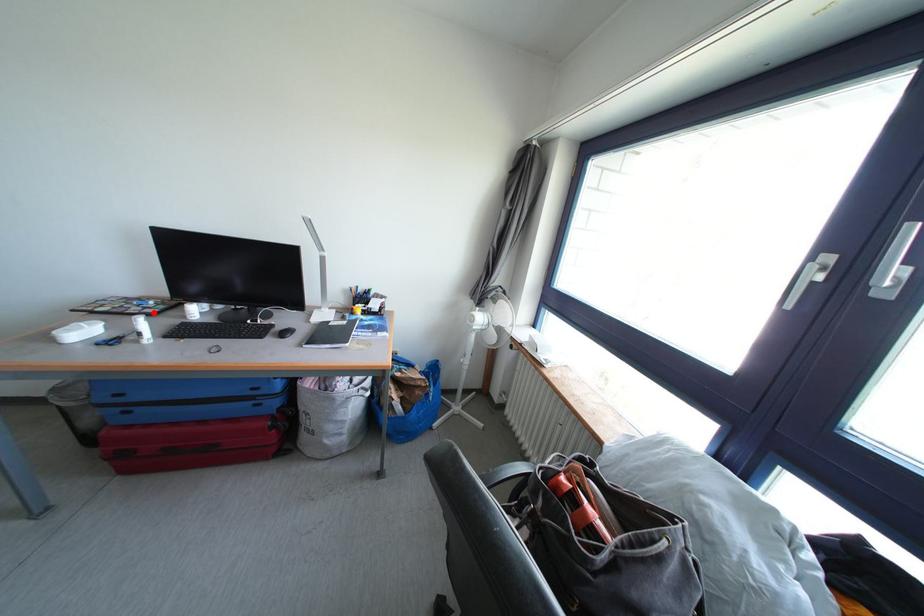
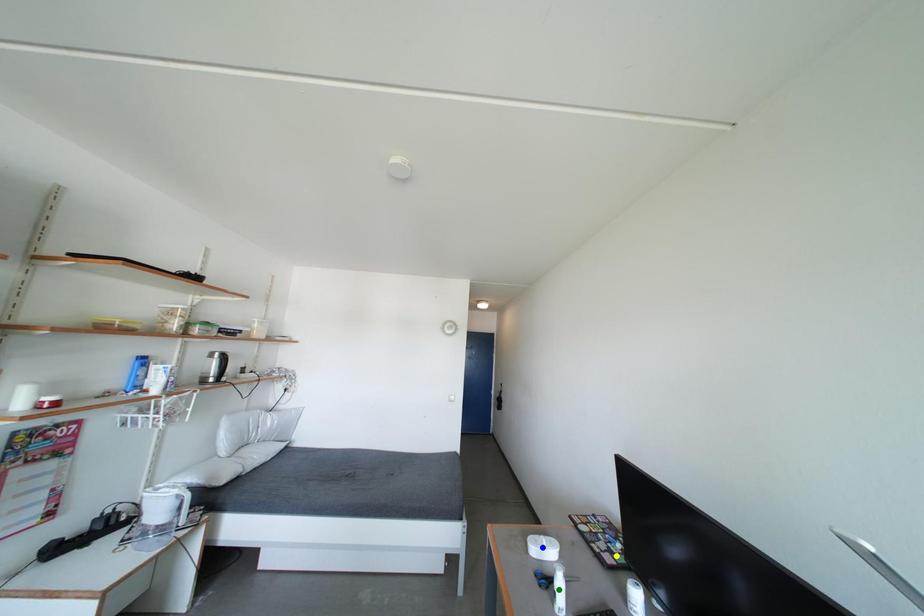
Question: I am providing you with two images of the same scene from different viewpoints. A red point is marked on the first image. You are given multiple points on the second image. In image 2, which mark is for the same physical point as the one in image 1?

Choices:
 (A) green point
 (B) blue point
 (C) yellow point

Answer: (C)